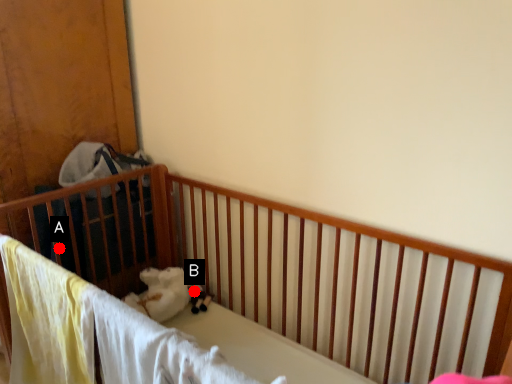
Question: Two points are circled on the image, labeled by A and B beside each circle. Which point is farther to the camera?

Choices:
 (A) A is further
 (B) B is further

Answer: (B)